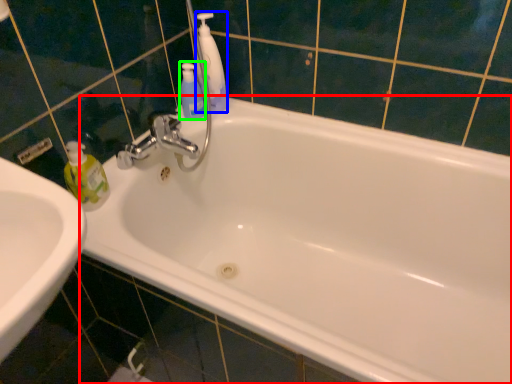
Question: Based on their relative distances, which object is nearer to bathtub (highlighted by a red box)? Choose from cleaning product (highlighted by a blue box) and mouthwash (highlighted by a green box).

Choices:
 (A) cleaning product
 (B) mouthwash

Answer: (A)